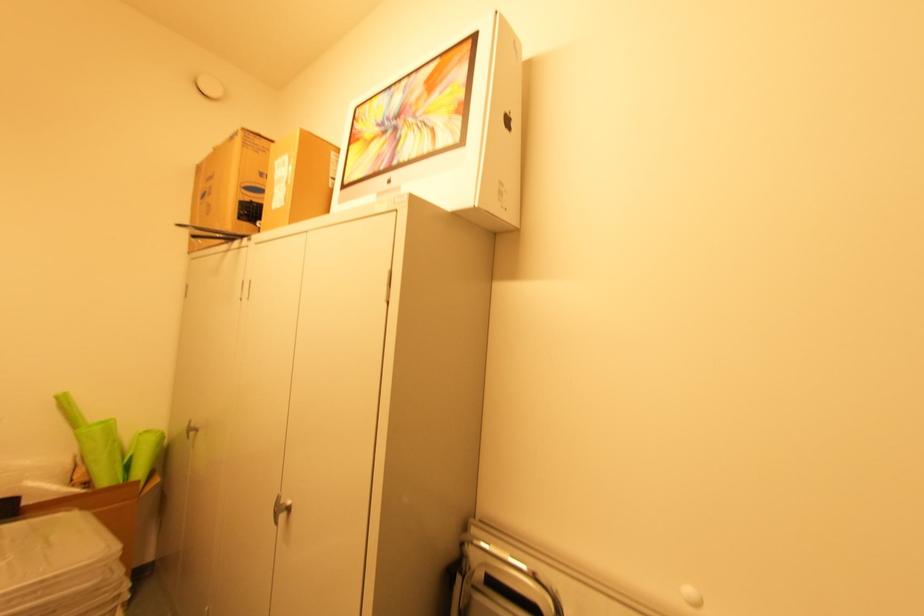
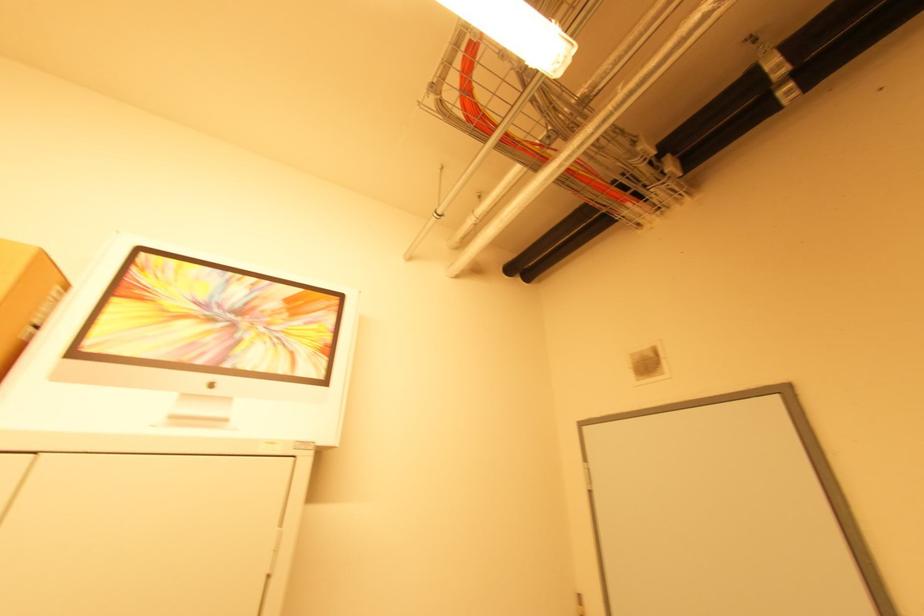
Where in the second image is the point corresponding to (x=353, y=148) from the first image?

(117, 300)